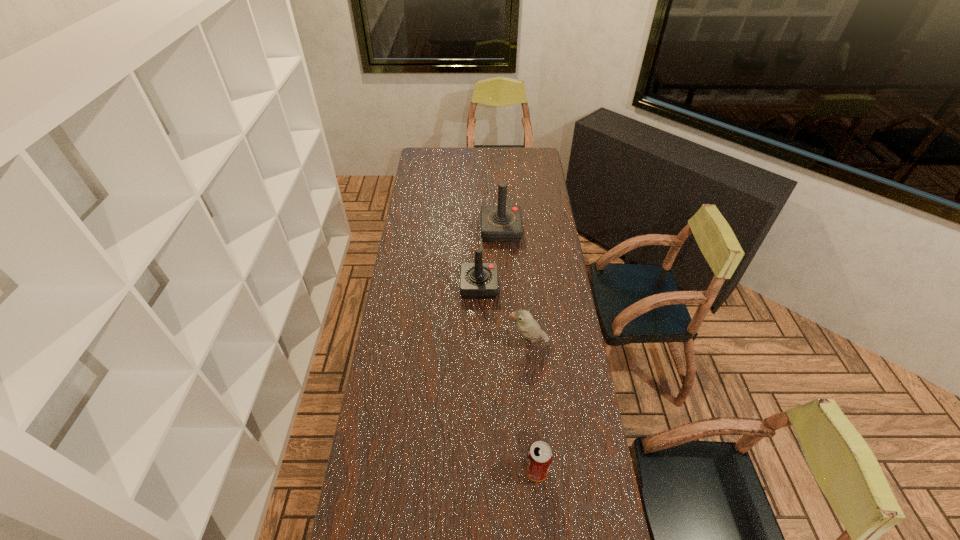
Find the location of a particular element. This screenshot has width=960, height=540. free space between the soda can and the shorter joystick is located at coordinates (508, 379).

This screenshot has width=960, height=540. I want to click on empty space that is in between the second nearest object and the farther joystick, so click(515, 287).

Find the location of a particular element. vacant area that lies between the shorter joystick and the second nearest object is located at coordinates (503, 315).

Find the location of a particular element. This screenshot has width=960, height=540. free space between the taller joystick and the third farthest object is located at coordinates (515, 287).

You are a GUI agent. You are given a task and a screenshot of the screen. Output one action in this format:
    pyautogui.click(x=<x>, y=<y>)
    Task: Click on the blank region between the taller joystick and the nearer joystick
    Image resolution: width=960 pixels, height=540 pixels.
    Given the screenshot: What is the action you would take?
    pyautogui.click(x=490, y=259)

Image resolution: width=960 pixels, height=540 pixels. What are the coordinates of `empty space between the bird and the shorter joystick` in the screenshot? It's located at (503, 315).

Locate an element on the screen. free space between the soda can and the bird is located at coordinates (532, 407).

This screenshot has width=960, height=540. What are the coordinates of `free space that is in between the bird and the third nearest object` in the screenshot? It's located at (503, 315).

Where is `free space between the second farthest object and the shortest object`? Image resolution: width=960 pixels, height=540 pixels. free space between the second farthest object and the shortest object is located at coordinates (508, 379).

Where is `vacant point located between the nearest object and the bird`? This screenshot has height=540, width=960. vacant point located between the nearest object and the bird is located at coordinates (532, 407).